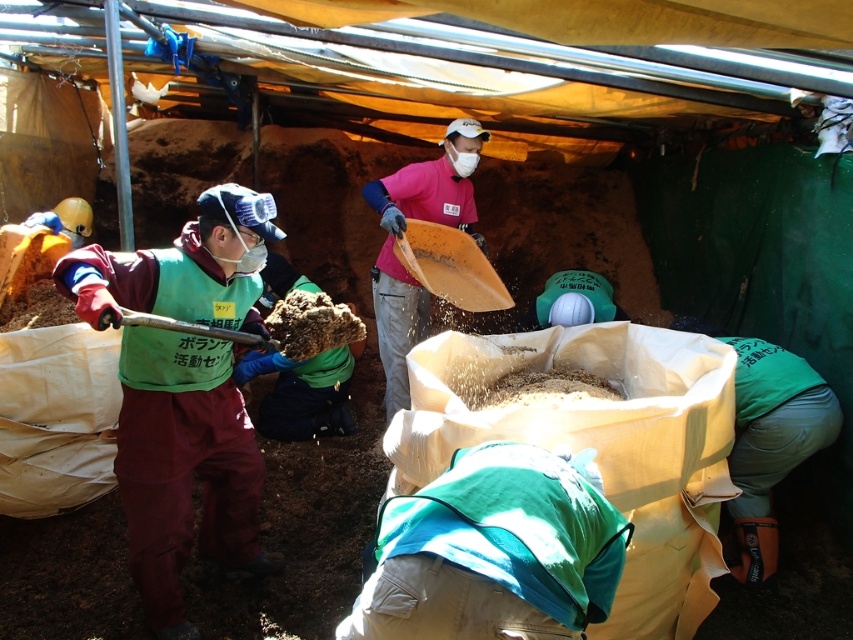
Question: Considering the real-world distances, which object is closest to the green fabric bag at lower right?

Choices:
 (A) wooden shovel at center
 (B) brushed metal shovel at left

Answer: (A)

Question: Is green fabric bag at lower right below brushed metal shovel at left?

Choices:
 (A) yes
 (B) no

Answer: (A)

Question: Which of the following is the closest to the observer?

Choices:
 (A) (437, 227)
 (B) (199, 330)
 (C) (807, 435)

Answer: (B)

Question: Which is nearer to the wooden shovel at center?

Choices:
 (A) green fabric bag at lower right
 (B) brushed metal shovel at left

Answer: (B)

Question: Can you confirm if green fabric bag at lower right is positioned to the right of brushed metal shovel at left?

Choices:
 (A) no
 (B) yes

Answer: (B)

Question: Does green fabric bag at lower right have a lesser width compared to wooden shovel at center?

Choices:
 (A) yes
 (B) no

Answer: (A)